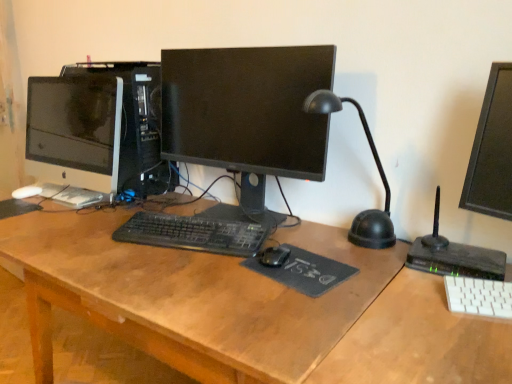
The image size is (512, 384). Identify the location of empty space that is ontop of wooden desk at center. (231, 262).